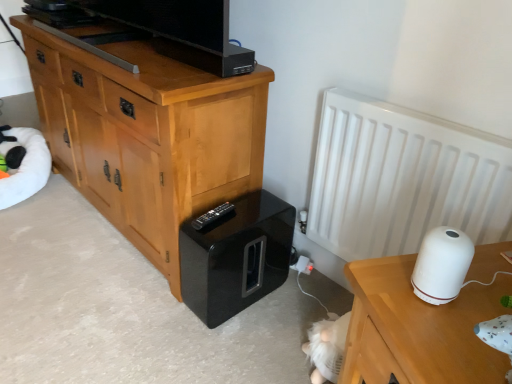
Question: Should I look upward or downward to see glossy black speaker at lower center?

Choices:
 (A) down
 (B) up

Answer: (A)

Question: Considering the relative sizes of white matte radiator at right and light brown wood chest of drawers at left in the image provided, is white matte radiator at right smaller than light brown wood chest of drawers at left?

Choices:
 (A) yes
 (B) no

Answer: (A)

Question: Is white matte radiator at right positioned behind light brown wood chest of drawers at left?

Choices:
 (A) no
 (B) yes

Answer: (A)

Question: Is white matte radiator at right next to light brown wood chest of drawers at left?

Choices:
 (A) no
 (B) yes

Answer: (A)

Question: Is white matte radiator at right turned away from light brown wood chest of drawers at left?

Choices:
 (A) yes
 (B) no

Answer: (B)

Question: From the image's perspective, is white matte radiator at right above light brown wood chest of drawers at left?

Choices:
 (A) yes
 (B) no

Answer: (B)

Question: Does white matte radiator at right come in front of light brown wood chest of drawers at left?

Choices:
 (A) yes
 (B) no

Answer: (A)

Question: Is white matte radiator at right looking in the opposite direction of black plastic remote at lower center?

Choices:
 (A) yes
 (B) no

Answer: (B)

Question: Is black plastic remote at lower center located within white matte radiator at right?

Choices:
 (A) no
 (B) yes

Answer: (A)

Question: Is white matte radiator at right positioned in front of black plastic remote at lower center?

Choices:
 (A) yes
 (B) no

Answer: (A)

Question: Does white matte radiator at right have a greater width compared to black plastic remote at lower center?

Choices:
 (A) no
 (B) yes

Answer: (A)

Question: Is white matte radiator at right taller than black plastic remote at lower center?

Choices:
 (A) yes
 (B) no

Answer: (A)

Question: Can you confirm if white matte radiator at right is positioned to the right of black plastic remote at lower center?

Choices:
 (A) no
 (B) yes

Answer: (B)

Question: Can you confirm if glossy black speaker at lower center is thinner than white matte table at right?

Choices:
 (A) yes
 (B) no

Answer: (A)